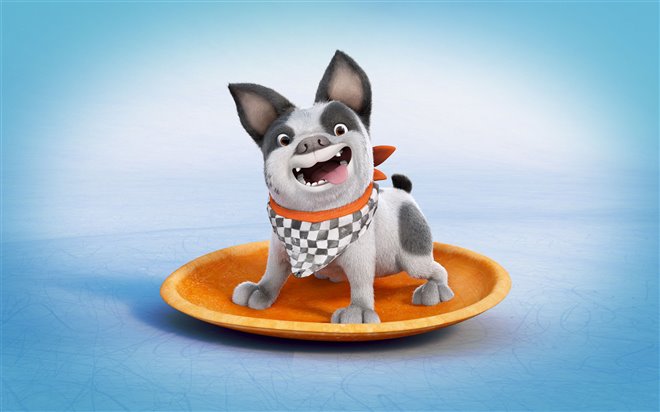
Identify the location of plate. (471, 284).